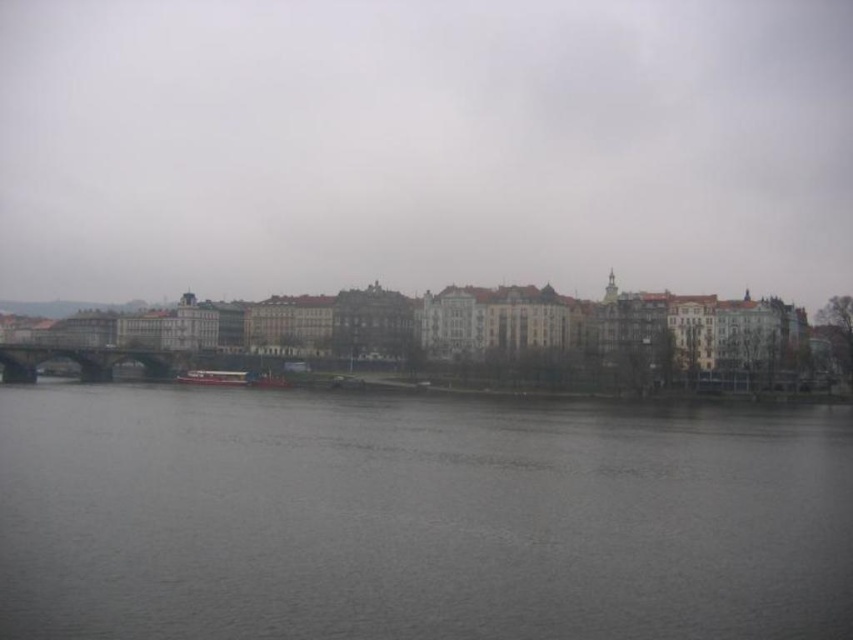
Can you confirm if matte gray buildings at center is bigger than gray water at center?

Correct, matte gray buildings at center is larger in size than gray water at center.

This screenshot has height=640, width=853. What do you see at coordinates (422, 145) in the screenshot? I see `matte gray buildings at center` at bounding box center [422, 145].

Find the location of a particular element. matte gray buildings at center is located at coordinates (422, 145).

Does matte gray buildings at center lie in front of green stone bridge at center?

Yes, matte gray buildings at center is in front of green stone bridge at center.

Does matte gray buildings at center appear under green stone bridge at center?

Incorrect, matte gray buildings at center is not positioned below green stone bridge at center.

The image size is (853, 640). Identify the location of matte gray buildings at center. (422, 145).

Locate an element on the screen. The width and height of the screenshot is (853, 640). matte gray buildings at center is located at coordinates (422, 145).

Which of these two, gray water at center or green stone bridge at center, stands taller?

green stone bridge at center

Is gray water at center positioned at the back of green stone bridge at center?

No, it is not.

Is point (587, 577) less distant than point (9, 381)?

Yes.

Where is `gray water at center`? gray water at center is located at coordinates (416, 518).